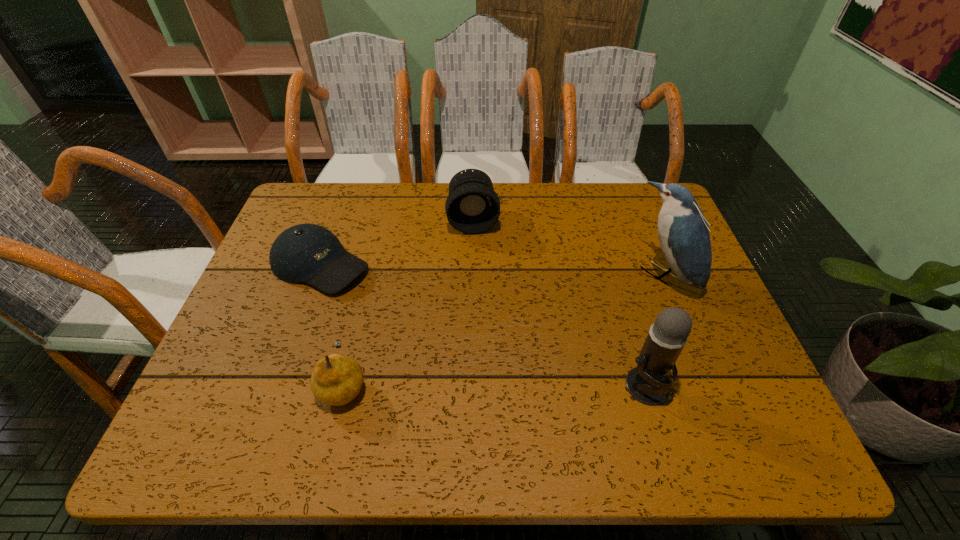
The width and height of the screenshot is (960, 540). I want to click on free space that is in between the fourth object from left to right and the shortest object, so click(x=483, y=325).

Locate an element on the screen. unoccupied position between the second shortest object and the baseball cap is located at coordinates (332, 324).

Where is `free space between the rightmost object and the third object from left to right`? Image resolution: width=960 pixels, height=540 pixels. free space between the rightmost object and the third object from left to right is located at coordinates (568, 247).

Where is `object identified as the closest to the pear`? This screenshot has width=960, height=540. object identified as the closest to the pear is located at coordinates (305, 253).

This screenshot has height=540, width=960. I want to click on object that stands as the second closest to the fourth tallest object, so click(472, 206).

Where is `vacant position in the image that satisfies the following two spatial constraints: 1. on the front side of the microphone; 2. on the left side of the shortest object`? The height and width of the screenshot is (540, 960). vacant position in the image that satisfies the following two spatial constraints: 1. on the front side of the microphone; 2. on the left side of the shortest object is located at coordinates (277, 386).

I want to click on free space that satisfies the following two spatial constraints: 1. on the back side of the fourth tallest object; 2. on the left side of the bird, so click(371, 275).